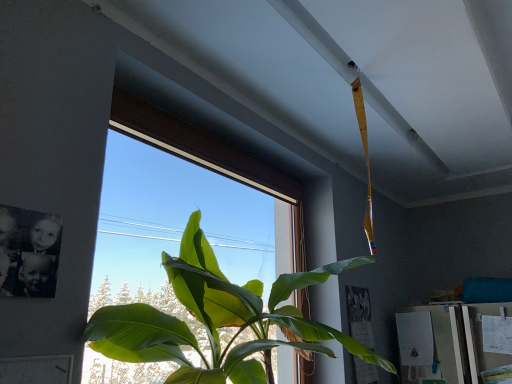
This screenshot has height=384, width=512. What do you see at coordinates (220, 319) in the screenshot?
I see `green leafy plant at center` at bounding box center [220, 319].

This screenshot has width=512, height=384. Identify the location of green leafy plant at center. (220, 319).

Describe the element at coordinates (207, 155) in the screenshot. I see `transparent glass window at center` at that location.

Measure the distance between point (x=201, y=149) and camera.

5.88 feet.

Where is `transparent glass window at center`? The image size is (512, 384). transparent glass window at center is located at coordinates (207, 155).

The height and width of the screenshot is (384, 512). I want to click on green leafy plant at center, so click(220, 319).

Considering the relative positions of green leafy plant at center and transparent glass window at center in the image provided, is green leafy plant at center to the right of transparent glass window at center from the viewer's perspective?

Indeed, green leafy plant at center is positioned on the right side of transparent glass window at center.

Does green leafy plant at center come behind transparent glass window at center?

No.

Considering the points (192, 234) and (300, 373), which point is behind, point (192, 234) or point (300, 373)?

The point (300, 373) is more distant.

In the scene shown: From the image's perspective, which object appears higher, green leafy plant at center or transparent glass window at center?

transparent glass window at center appears higher in the image.

From a real-world perspective, relative to transparent glass window at center, is green leafy plant at center vertically above or below?

In terms of real-world spatial position, green leafy plant at center is below transparent glass window at center.

Considering the relative sizes of green leafy plant at center and transparent glass window at center in the image provided, is green leafy plant at center thinner than transparent glass window at center?

Incorrect, the width of green leafy plant at center is not less than that of transparent glass window at center.

Is green leafy plant at center taller than transparent glass window at center?

No.

Considering the relative sizes of green leafy plant at center and transparent glass window at center in the image provided, is green leafy plant at center bigger than transparent glass window at center?

Indeed, green leafy plant at center has a larger size compared to transparent glass window at center.

Is green leafy plant at center located outside transparent glass window at center?

Yes, green leafy plant at center is not within transparent glass window at center.

Are green leafy plant at center and transparent glass window at center far apart?

No, green leafy plant at center is not far away from transparent glass window at center.

In the scene shown: Is green leafy plant at center looking in the opposite direction of transparent glass window at center?

Yes.

Find the location of a particular element. The image size is (512, 384). houseplant below the transparent glass window at center (from the image's perspective) is located at coordinates (220, 319).

Based on the photo, which is more to the left, transparent glass window at center or green leafy plant at center?

transparent glass window at center.

Is transparent glass window at center further to camera compared to green leafy plant at center?

Yes, transparent glass window at center is further from the camera.

Which point is more forward, (222,168) or (362,351)?

The point (362,351) is more forward.

From the image's perspective, is transparent glass window at center positioned above or below green leafy plant at center?

From the image's perspective, transparent glass window at center appears above green leafy plant at center.

From a real-world perspective, which object rests below the other?

From a 3D spatial view, green leafy plant at center is below.

Considering the sizes of transparent glass window at center and green leafy plant at center in the image, is transparent glass window at center wider or thinner than green leafy plant at center?

transparent glass window at center is thinner than green leafy plant at center.

Considering the sizes of transparent glass window at center and green leafy plant at center in the image, is transparent glass window at center taller or shorter than green leafy plant at center?

Considering their sizes, transparent glass window at center has more height than green leafy plant at center.

Which of these two, transparent glass window at center or green leafy plant at center, is bigger?

With larger size is green leafy plant at center.

Could green leafy plant at center be considered to be inside transparent glass window at center?

No, green leafy plant at center is not inside transparent glass window at center.

Are transparent glass window at center and green leafy plant at center located far from each other?

transparent glass window at center is actually quite close to green leafy plant at center.

Is transparent glass window at center looking in the opposite direction of green leafy plant at center?

Yes, transparent glass window at center is positioned with its back facing green leafy plant at center.

What's the angular difference between transparent glass window at center and green leafy plant at center's facing directions?

There is a 5.77-degree angle between the facing directions of transparent glass window at center and green leafy plant at center.

What are the coordinates of `window above the green leafy plant at center (from a real-world perspective)` in the screenshot? It's located at (207, 155).

Locate an element on the screen. window above the green leafy plant at center (from the image's perspective) is located at coordinates (207, 155).

In the image, there is a transparent glass window at center. Where is `houseplant below it (from a real-world perspective)`? houseplant below it (from a real-world perspective) is located at coordinates (220, 319).